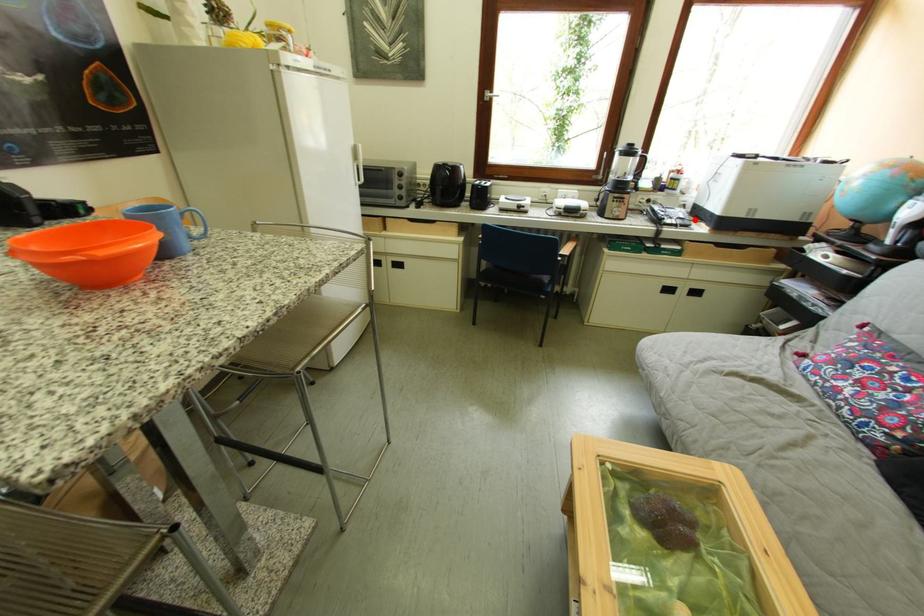
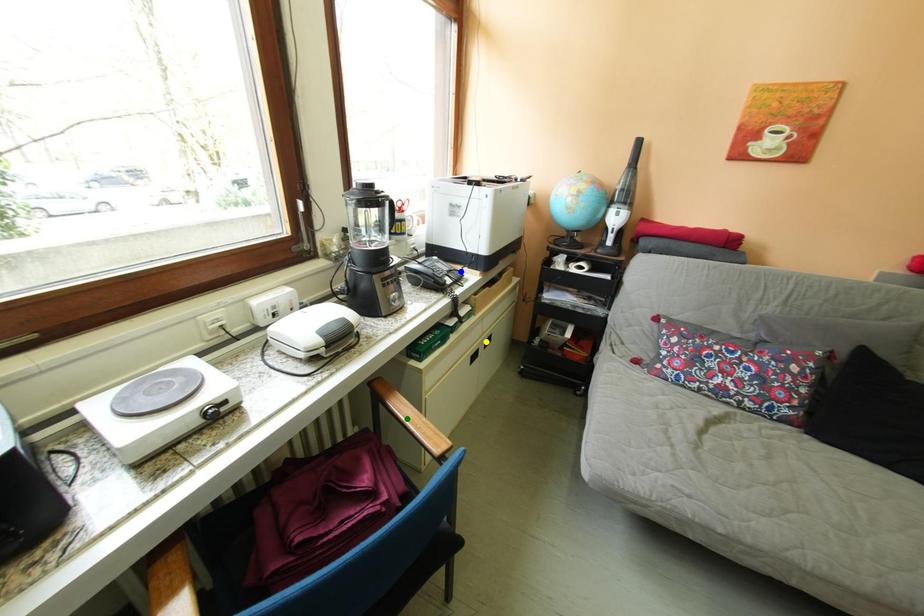
Question: I am providing you with two images of the same scene from different viewpoints. A red point is marked on the first image. You are given multiple points on the second image. In image 2, which mark is for the same physical point as the one in image 1?

Choices:
 (A) yellow point
 (B) green point
 (C) blue point

Answer: (C)